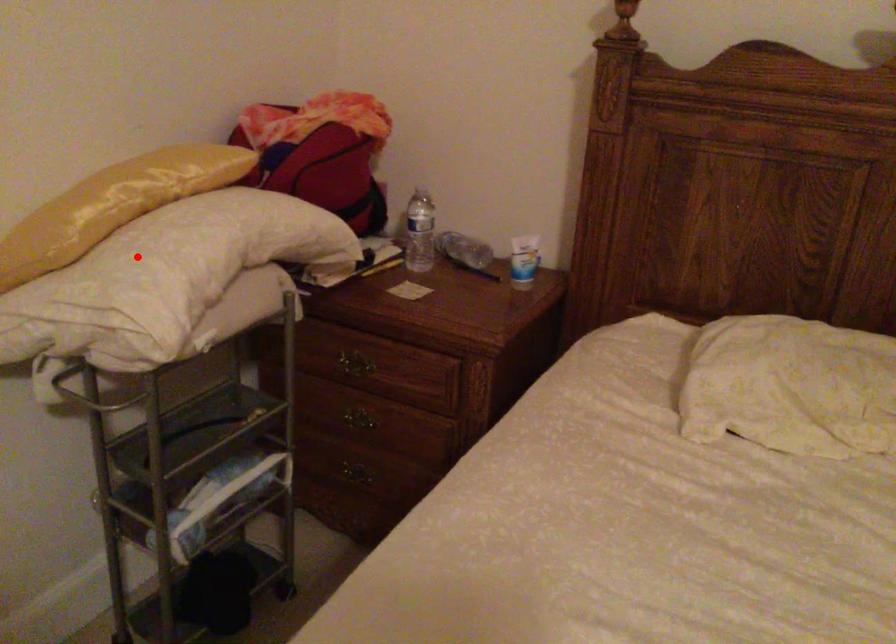
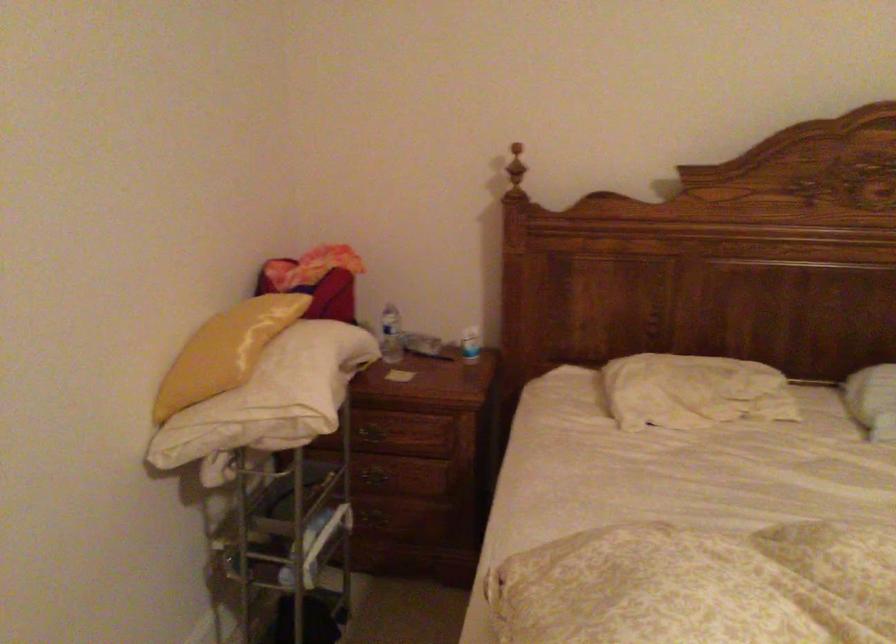
The point at the highlighted location is marked in the first image. Where is the corresponding point in the second image?

(287, 375)